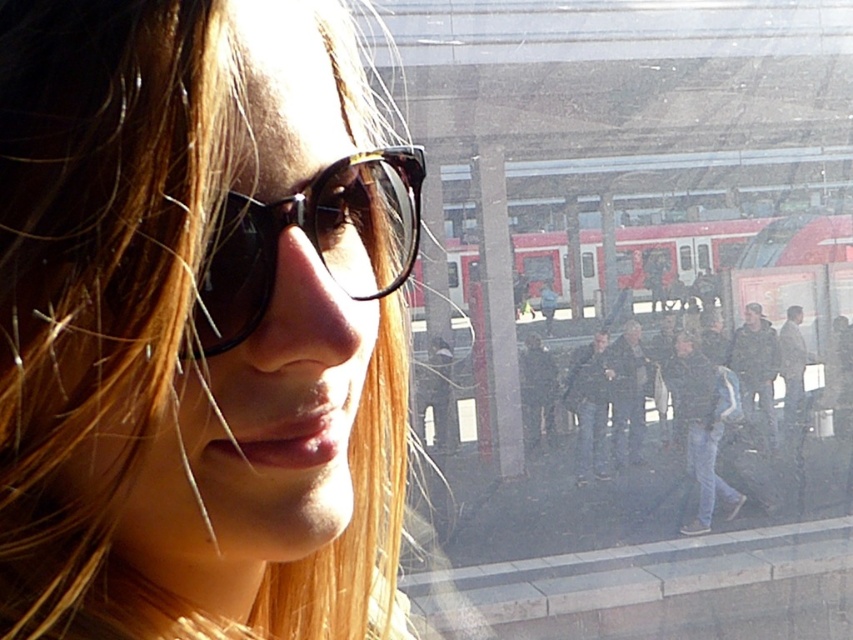
Can you confirm if matte black sunglasses at center is positioned above black leather jacket at center?

Correct, matte black sunglasses at center is located above black leather jacket at center.

Looking at this image, who is positioned more to the right, matte black sunglasses at center or black leather jacket at center?

From the viewer's perspective, black leather jacket at center appears more on the right side.

What do you see at coordinates (199, 324) in the screenshot?
I see `matte black sunglasses at center` at bounding box center [199, 324].

The height and width of the screenshot is (640, 853). Find the location of `matte black sunglasses at center`. matte black sunglasses at center is located at coordinates (199, 324).

Locate an element on the screen. matte black sunglasses at center is located at coordinates (199, 324).

Describe the element at coordinates (199, 324) in the screenshot. The width and height of the screenshot is (853, 640). I see `matte black sunglasses at center` at that location.

Find the location of `matte black sunglasses at center`. matte black sunglasses at center is located at coordinates [x=199, y=324].

How distant is matte black sunglasses at center from dark gray fabric jacket at center?

The distance of matte black sunglasses at center from dark gray fabric jacket at center is 16.21 meters.

Describe the element at coordinates (199, 324) in the screenshot. I see `matte black sunglasses at center` at that location.

Who is more distant from viewer, (395, 557) or (538, 396)?

Point (538, 396)

Locate an element on the screen. matte black sunglasses at center is located at coordinates (199, 324).